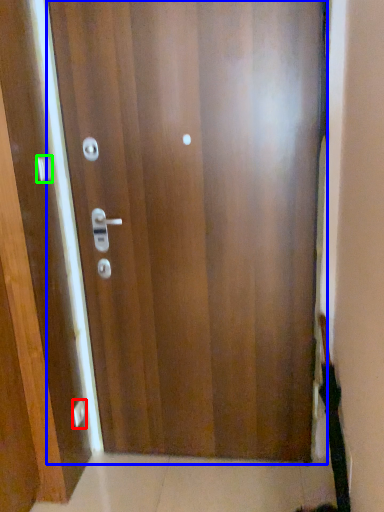
Question: Which is farther away from knob (highlighted by a red box)? door (highlighted by a blue box) or handle (highlighted by a green box)?

Choices:
 (A) door
 (B) handle

Answer: (A)